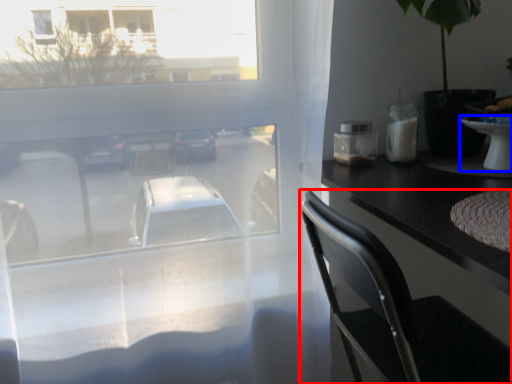
Question: Which object appears closest to the camera in this image, chair (highlighted by a red box) or table (highlighted by a blue box)?

Choices:
 (A) chair
 (B) table

Answer: (A)